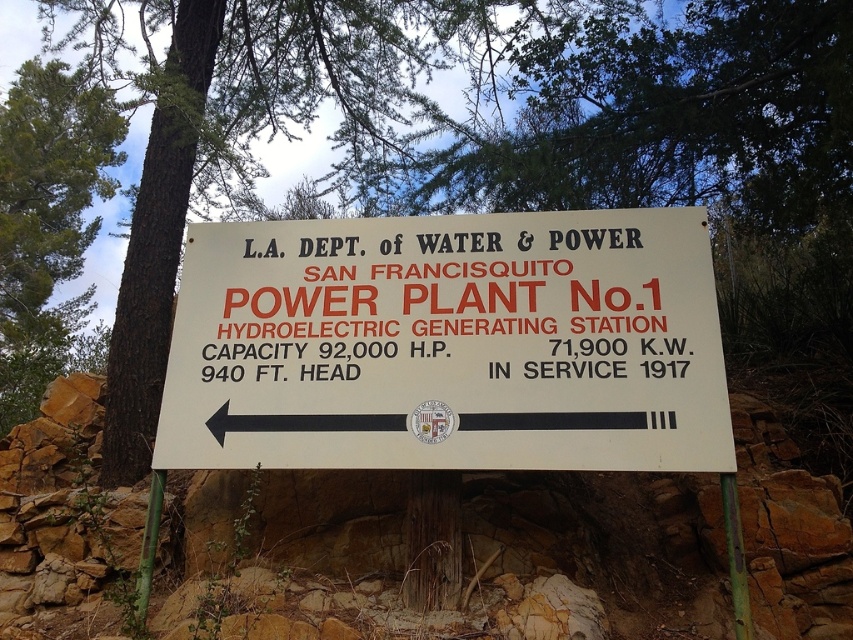
Question: Which object is positioned farthest from the green leafy tree at upper center?

Choices:
 (A) green textured bark at upper left
 (B) white matte sign at center

Answer: (A)

Question: Does white matte sign at center have a larger size compared to green leafy tree at upper center?

Choices:
 (A) yes
 (B) no

Answer: (B)

Question: Is green leafy tree at upper center behind green textured bark at upper left?

Choices:
 (A) no
 (B) yes

Answer: (B)

Question: Which is farther from the white matte sign at center?

Choices:
 (A) green textured bark at upper left
 (B) green leafy tree at upper center

Answer: (A)

Question: In this image, where is white matte sign at center located relative to green textured bark at upper left?

Choices:
 (A) above
 (B) below

Answer: (B)

Question: Considering the real-world distances, which object is closest to the green textured bark at upper left?

Choices:
 (A) white matte sign at center
 (B) green leafy tree at upper center

Answer: (B)